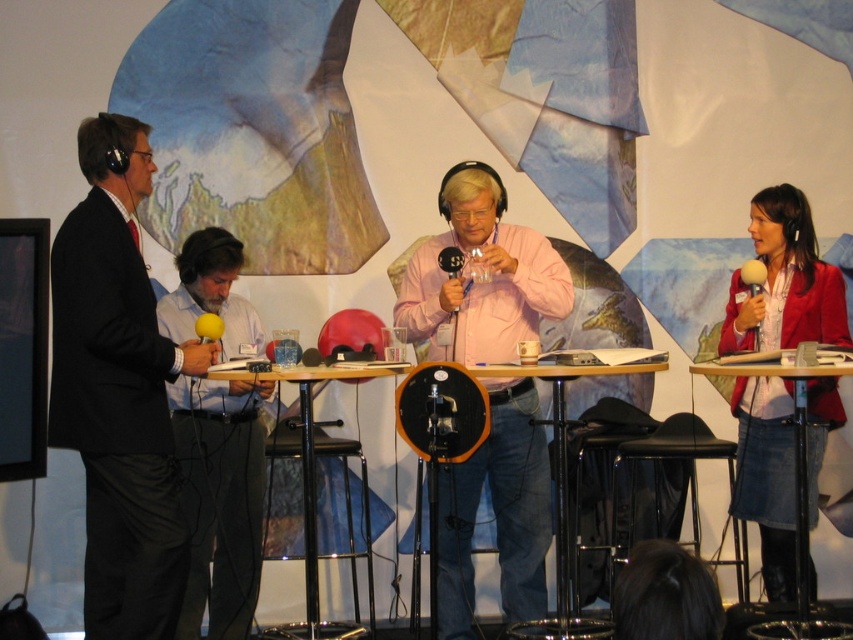
Question: Is matte blue shirt at center positioned behind wooden table at center?

Choices:
 (A) no
 (B) yes

Answer: (B)

Question: Can you confirm if matte blue shirt at center is wider than denim skirt at lower right?

Choices:
 (A) yes
 (B) no

Answer: (B)

Question: Which point is closer to the camera taking this photo?

Choices:
 (A) (326, 365)
 (B) (242, 618)
 (C) (662, 461)

Answer: (A)

Question: From the image, what is the correct spatial relationship of black plastic table at center in relation to black plastic stool at lower center?

Choices:
 (A) below
 (B) above

Answer: (B)

Question: Which point is closer to the camera?

Choices:
 (A) black suit at left
 (B) matte blue shirt at center

Answer: (A)

Question: Which object is the closest to the black plastic table at center?

Choices:
 (A) pink matte shirt at center
 (B) wooden table at center

Answer: (A)